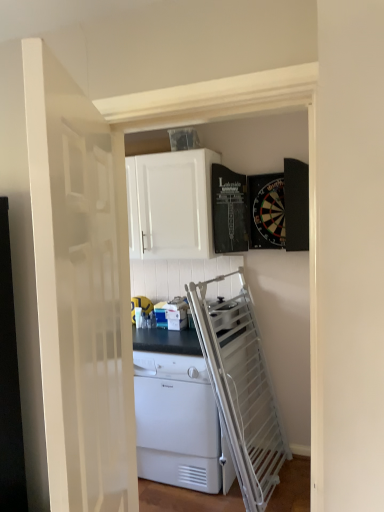
Question: Is white plastic dishwasher at center oriented towards white matte cabinet at upper center?

Choices:
 (A) yes
 (B) no

Answer: (B)

Question: From the image's perspective, would you say white plastic dishwasher at center is shown under white matte cabinet at upper center?

Choices:
 (A) yes
 (B) no

Answer: (A)

Question: From a real-world perspective, does white plastic dishwasher at center sit lower than white matte cabinet at upper center?

Choices:
 (A) yes
 (B) no

Answer: (A)

Question: Is white plastic dishwasher at center thinner than white matte cabinet at upper center?

Choices:
 (A) no
 (B) yes

Answer: (A)

Question: Is white plastic dishwasher at center turned away from white matte cabinet at upper center?

Choices:
 (A) yes
 (B) no

Answer: (B)

Question: Would you say white plastic dishwasher at center is a long distance from white matte cabinet at upper center?

Choices:
 (A) yes
 (B) no

Answer: (A)

Question: Are white plastic dishwasher at center and white glossy door at center making contact?

Choices:
 (A) no
 (B) yes

Answer: (A)

Question: Is white plastic dishwasher at center behind white glossy door at center?

Choices:
 (A) yes
 (B) no

Answer: (A)

Question: Can you confirm if white plastic dishwasher at center is wider than white glossy door at center?

Choices:
 (A) yes
 (B) no

Answer: (A)

Question: Can you confirm if white plastic dishwasher at center is thinner than white glossy door at center?

Choices:
 (A) no
 (B) yes

Answer: (A)

Question: Can white glossy door at center be found inside white plastic dishwasher at center?

Choices:
 (A) yes
 (B) no

Answer: (B)

Question: Considering the relative positions of white plastic dishwasher at center and white glossy door at center in the image provided, is white plastic dishwasher at center to the left of white glossy door at center from the viewer's perspective?

Choices:
 (A) no
 (B) yes

Answer: (A)

Question: From the image's perspective, is white glossy door at center under white plastic dishwasher at center?

Choices:
 (A) yes
 (B) no

Answer: (B)